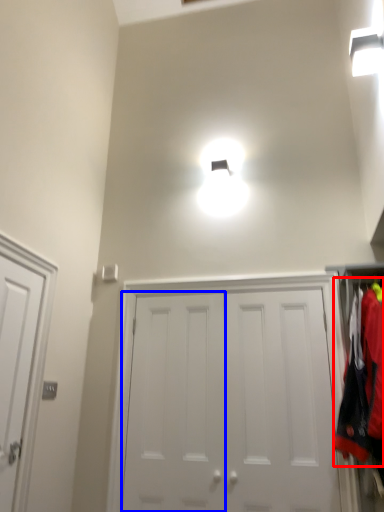
Question: Which object appears farthest to the camera in this image, laundry (highlighted by a red box) or door (highlighted by a blue box)?

Choices:
 (A) laundry
 (B) door

Answer: (B)